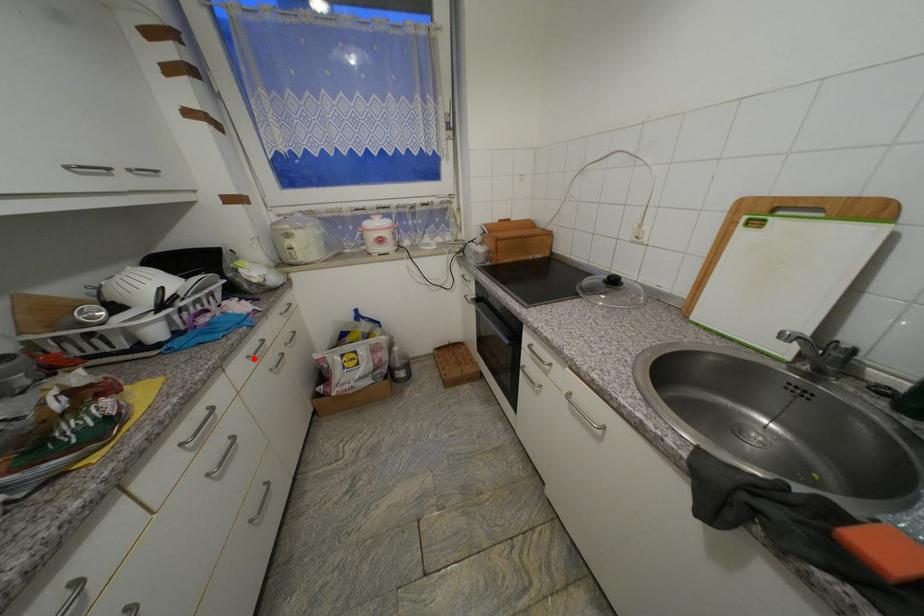
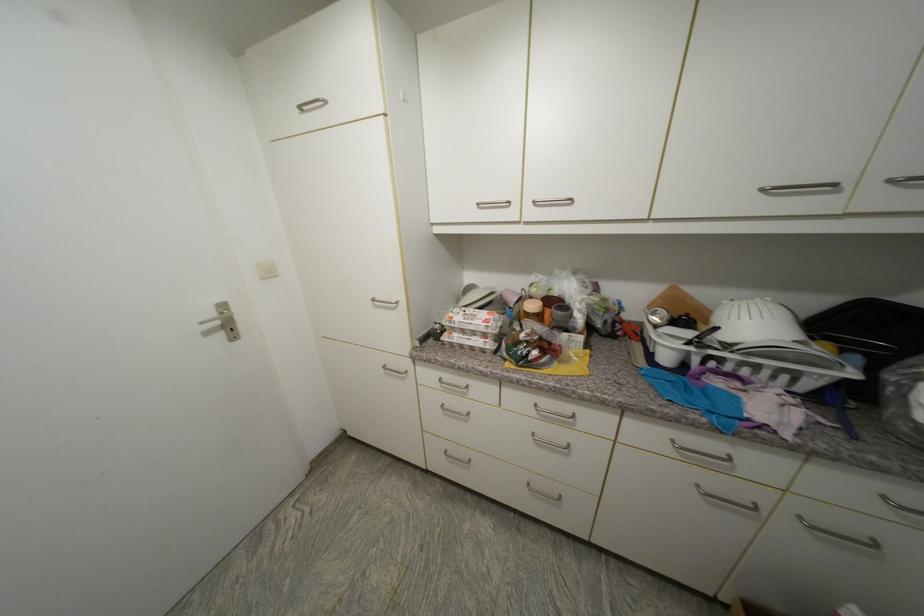
Where in the second image is the point corresponding to the highlighted location from the first image?

(678, 443)